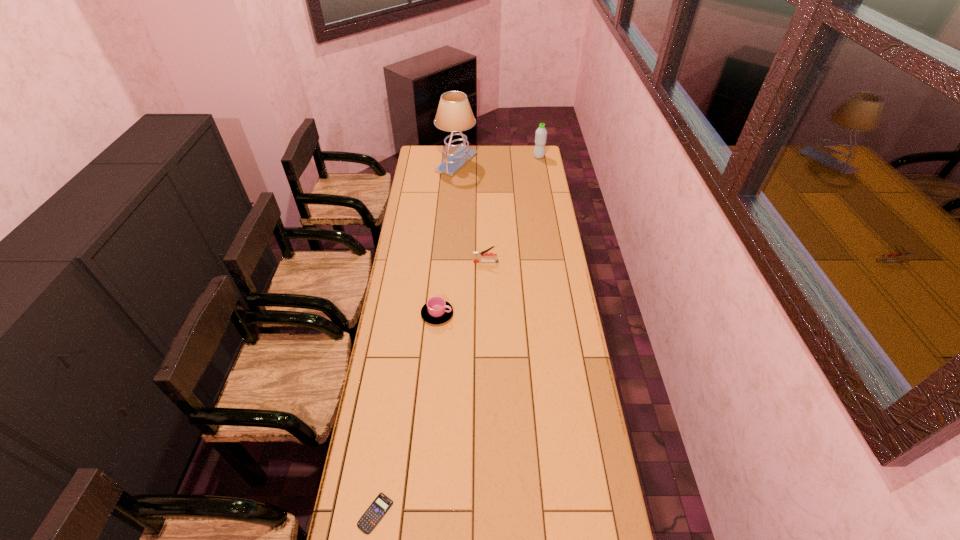
I want to click on unoccupied area between the fourth shortest object and the second nearest object, so click(x=488, y=235).

Locate an element on the screen. The width and height of the screenshot is (960, 540). blank region between the table lamp and the second nearest object is located at coordinates (447, 238).

The image size is (960, 540). Find the location of `vacant space that is in between the water bottle and the shortest object`. vacant space that is in between the water bottle and the shortest object is located at coordinates (x=457, y=335).

The width and height of the screenshot is (960, 540). In order to click on unoccupied area between the tallest object and the shortest object in this screenshot , I will do `click(416, 338)`.

Find the location of a particular element. This screenshot has height=540, width=960. unoccupied area between the third shortest object and the fourth farthest object is located at coordinates (462, 288).

The width and height of the screenshot is (960, 540). What are the coordinates of `unoccupied position between the second nearest object and the water bottle` in the screenshot? It's located at (488, 235).

Locate an element on the screen. the third closest object to the water bottle is located at coordinates (436, 311).

Locate which object is the closest to the fourth shortest object. Please provide its 2D coordinates. Your answer should be formatted as a tuple, i.e. [(x, y)], where the tuple contains the x and y coordinates of a point satisfying the conditions above.

[(454, 114)]

In order to click on blank space that satisfies the following two spatial constraints: 1. on the front side of the water bottle; 2. on the side with the handle of the cup in this screenshot , I will do `click(566, 314)`.